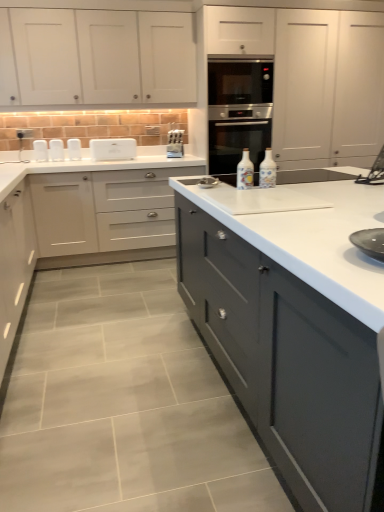
Find the location of a particular element. The image size is (384, 512). free point in front of white ceramic bottle at center, positioned as the second bottle in left-to-right order is located at coordinates (284, 190).